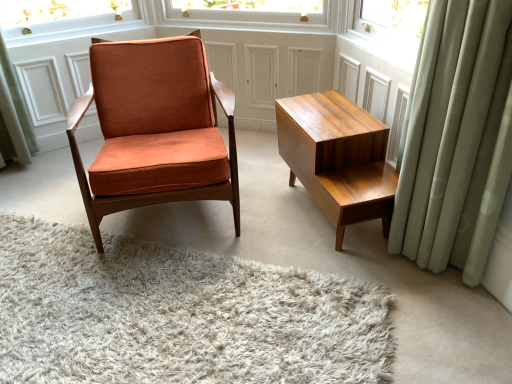
You are a GUI agent. You are given a task and a screenshot of the screen. Output one action in this format:
    pyautogui.click(x=<x>, y=<y>)
    Task: Click on the free space above white shag rug at center (from a real-world perspective)
    
    Given the screenshot: What is the action you would take?
    pyautogui.click(x=139, y=299)